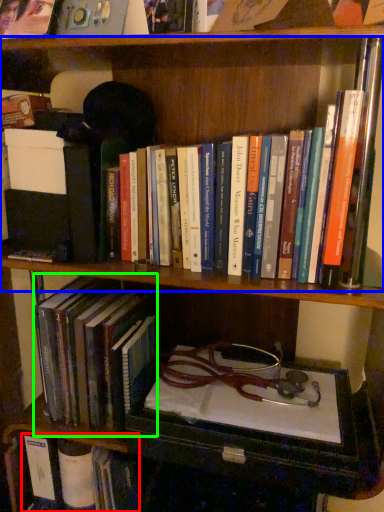
Question: Which object is the closest to the book (highlighted by a red box)? Choose among these: book (highlighted by a blue box) or book (highlighted by a green box).

Choices:
 (A) book
 (B) book

Answer: (B)